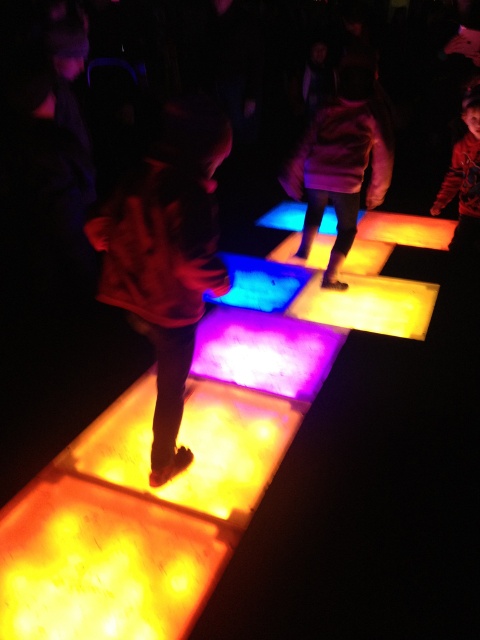
Question: Which of these objects is positioned closest to the matte orange square at center?

Choices:
 (A) translucent glowing square at center
 (B) matte purple sweater at center

Answer: (A)

Question: Does matte orange square at center have a larger size compared to matte purple sweater at center?

Choices:
 (A) yes
 (B) no

Answer: (B)

Question: Which of these objects is positioned closest to the translucent glowing square at center?

Choices:
 (A) matte purple sweater at center
 (B) matte orange square at center

Answer: (B)

Question: Observing the image, what is the correct spatial positioning of translucent glowing square at center in reference to matte orange square at center?

Choices:
 (A) right
 (B) left

Answer: (A)

Question: Can you confirm if matte orange square at center is bigger than matte purple sweater at center?

Choices:
 (A) no
 (B) yes

Answer: (A)

Question: Which of the following is the closest to the observer?

Choices:
 (A) (133, 499)
 (B) (182, 163)
 (C) (340, 260)

Answer: (B)